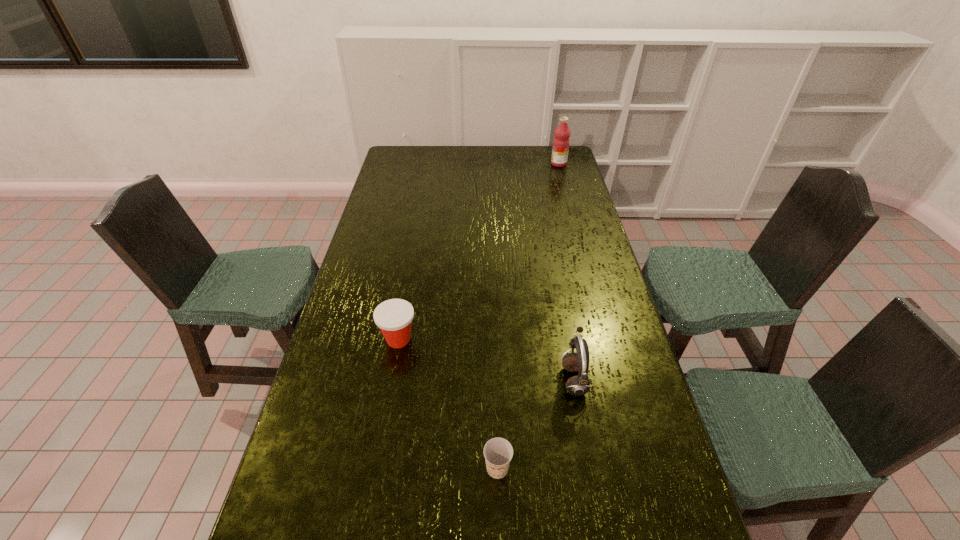
Find the location of a particular element. vacant area situated 0.360m on the label of the tallest object is located at coordinates (478, 164).

Where is `free space located on the ear pads of the earphone`? Image resolution: width=960 pixels, height=540 pixels. free space located on the ear pads of the earphone is located at coordinates (534, 379).

The width and height of the screenshot is (960, 540). Find the location of `vacant area situated 0.130m on the ear pads of the earphone`. vacant area situated 0.130m on the ear pads of the earphone is located at coordinates (516, 379).

Locate an element on the screen. Image resolution: width=960 pixels, height=540 pixels. vacant space situated on the ear pads of the earphone is located at coordinates (502, 379).

This screenshot has width=960, height=540. I want to click on vacant area situated 0.120m on the left of the leftmost object, so click(341, 340).

At what (x,y) coordinates should I click in order to perform the action: click on vacant space located on the front of the right Dixie cup. Please return your answer as a coordinate pair (x, y). This screenshot has width=960, height=540. Looking at the image, I should click on (499, 539).

Identify the location of object that is at the far edge. (561, 142).

The height and width of the screenshot is (540, 960). In order to click on object at the left edge in this screenshot , I will do `click(394, 317)`.

This screenshot has width=960, height=540. I want to click on object that is at the right edge, so pos(561,142).

Identify the location of object at the far right corner. (561, 142).